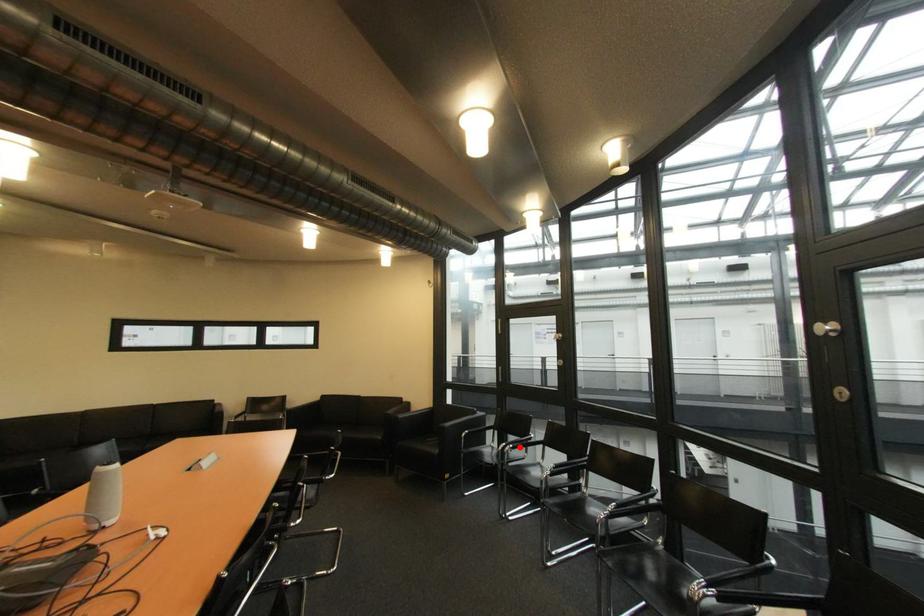
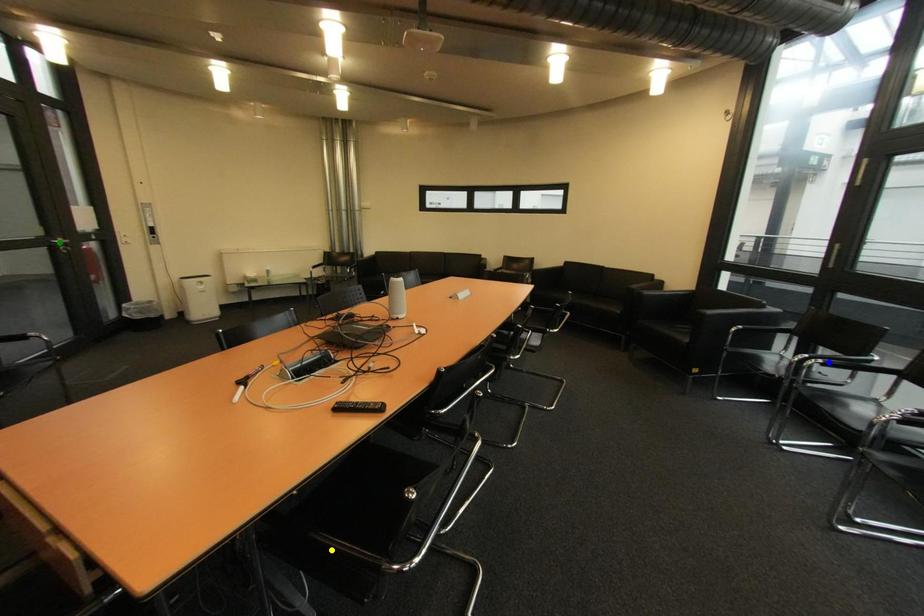
Question: I am providing you with two images of the same scene from different viewpoints. A red point is marked on the first image. You are given multiple points on the second image. Which mark in image 2 goes with the point in image 1?

Choices:
 (A) green point
 (B) blue point
 (C) yellow point

Answer: (B)